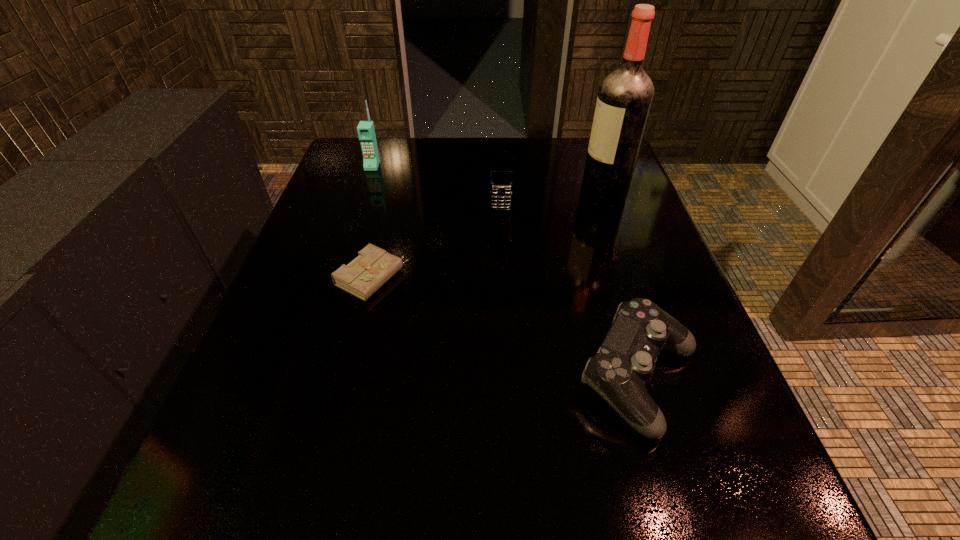
Find the location of a particular element. This screenshot has width=960, height=540. vacant space situated on the front-facing side of the tallest object is located at coordinates (546, 196).

At what (x,y) coordinates should I click in order to perform the action: click on free space located 0.210m on the front-facing side of the tallest object. Please return your answer as a coordinate pair (x, y). The width and height of the screenshot is (960, 540). Looking at the image, I should click on (491, 196).

This screenshot has width=960, height=540. I want to click on vacant space located on the keypad of the farther cellular telephone, so click(351, 227).

Find the location of a particular element. The width and height of the screenshot is (960, 540). vacant space located on the screen of the third shortest object is located at coordinates (508, 346).

Find the location of a particular element. The height and width of the screenshot is (540, 960). vacant space situated on the left of the control is located at coordinates (470, 379).

What are the coordinates of `vacant region located 0.180m on the right of the shortest object` in the screenshot? It's located at (500, 278).

Find the location of a particular element. This screenshot has width=960, height=540. object that is at the far edge is located at coordinates (366, 132).

Identify the location of cellular telephone at the left edge. The image size is (960, 540). coord(366,132).

The image size is (960, 540). Find the location of `diary present at the left edge`. diary present at the left edge is located at coordinates (362, 277).

The width and height of the screenshot is (960, 540). I want to click on liquor that is at the right edge, so click(624, 99).